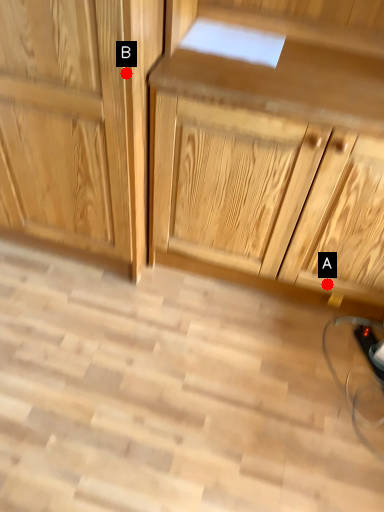
Question: Two points are circled on the image, labeled by A and B beside each circle. Which of the following is the farthest from the observer?

Choices:
 (A) A is further
 (B) B is further

Answer: (A)